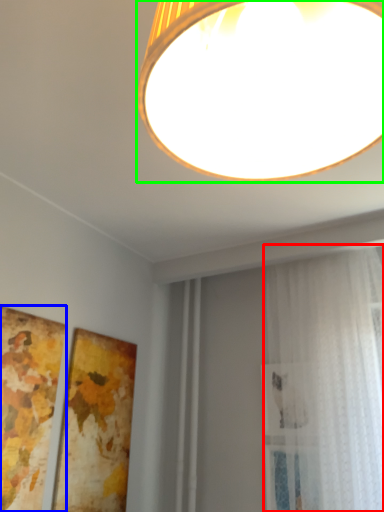
Question: Estimate the real-world distances between objects in this image. Which object is farther from curtain (highlighted by a red box), picture frame (highlighted by a blue box) or lamp (highlighted by a green box)?

Choices:
 (A) picture frame
 (B) lamp

Answer: (B)